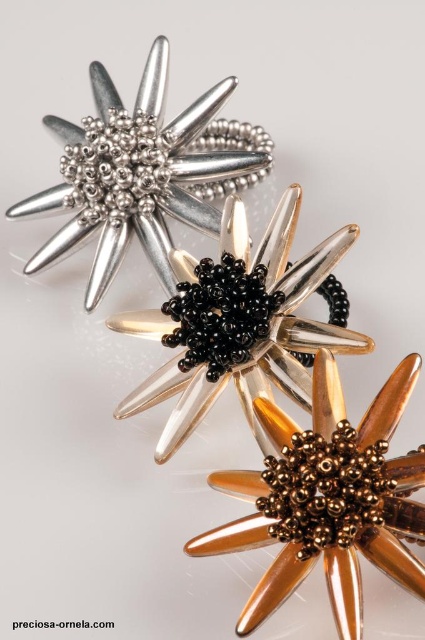
Which is more to the left, black beaded flower at center or matte silver flower at upper left?

matte silver flower at upper left

Which is behind, point (275, 337) or point (136, 188)?

Positioned behind is point (136, 188).

Describe the element at coordinates (240, 324) in the screenshot. I see `black beaded flower at center` at that location.

The width and height of the screenshot is (425, 640). Identify the location of black beaded flower at center. (240, 324).

From the picture: Who is positioned more to the right, gold metallic flower at center or matte silver flower at upper left?

gold metallic flower at center is more to the right.

Does gold metallic flower at center appear over matte silver flower at upper left?

Actually, gold metallic flower at center is below matte silver flower at upper left.

Who is more distant from viewer, (x=363, y=529) or (x=153, y=81)?

Point (x=153, y=81)

Find the location of a particular element. Image resolution: width=425 pixels, height=640 pixels. gold metallic flower at center is located at coordinates (320, 518).

Does black beaded flower at center lie behind gold metallic flower at center?

That is True.

Between point (272, 442) and point (354, 554), which one is positioned in front?

Positioned in front is point (354, 554).

Where is `black beaded flower at center`? Image resolution: width=425 pixels, height=640 pixels. black beaded flower at center is located at coordinates (240, 324).